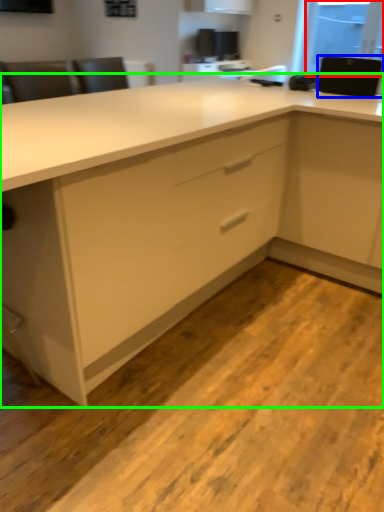
Question: Which is farther away from window screen (highlighted by a red box)? appliance (highlighted by a blue box) or cabinetry (highlighted by a green box)?

Choices:
 (A) appliance
 (B) cabinetry

Answer: (B)